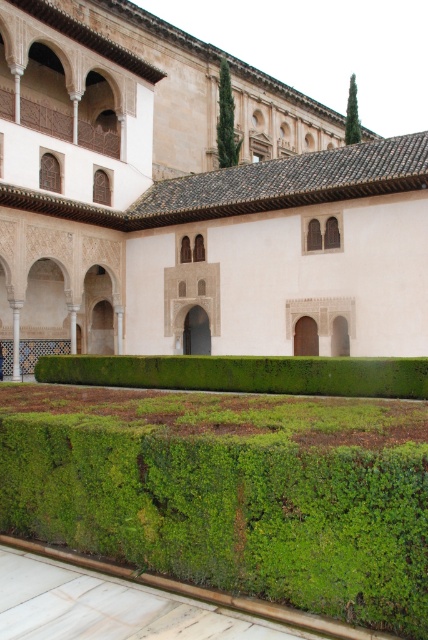
From the picture: Does green mossy hedge at center appear on the right side of green leafy hedge at center?

No, green mossy hedge at center is not to the right of green leafy hedge at center.

Is green mossy hedge at center thinner than green leafy hedge at center?

Correct, green mossy hedge at center's width is less than green leafy hedge at center's.

Locate an element on the screen. This screenshot has width=428, height=640. green mossy hedge at center is located at coordinates (231, 492).